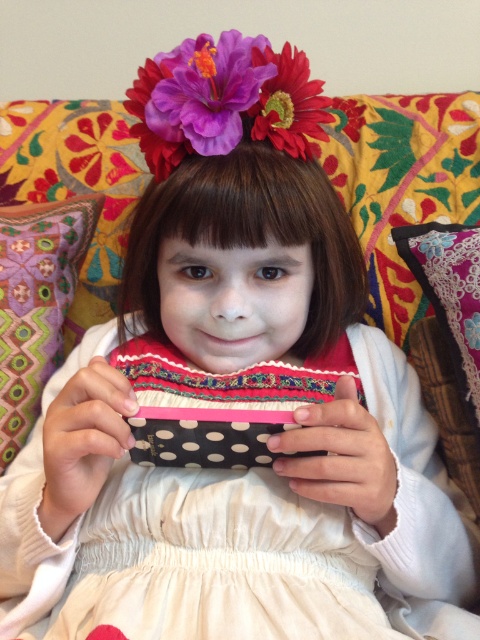
Where is the white satin dress at center located in the image?

The white satin dress at center is located at point [228,561] in the image.

You are taking a photo of the girl and want to ensure both the point at point (424, 257) and the point at point (300, 138) are in focus. Which point is closer to the camera?

Point (300, 138) is closer to the camera than point (424, 257).